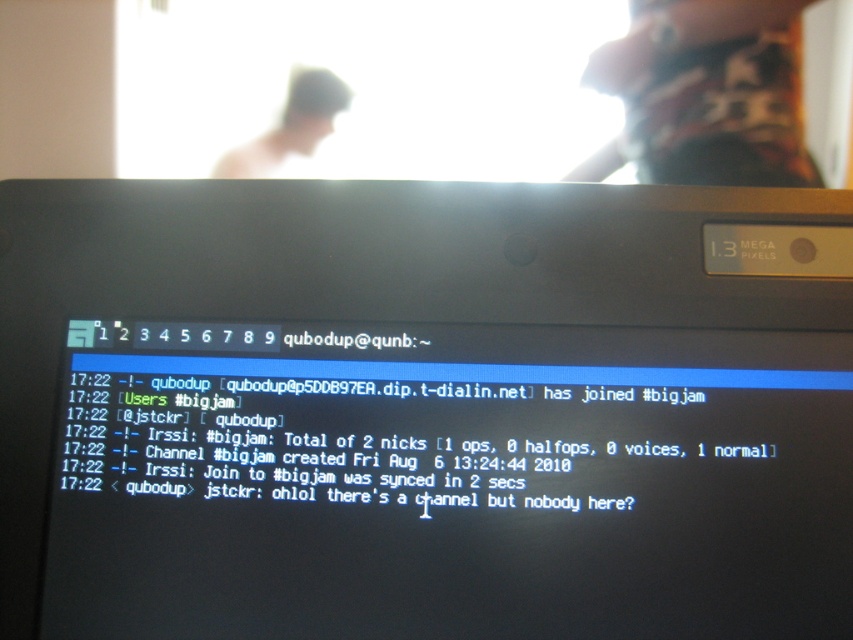
Between dark red fabric shirt at upper right and blurred skin head at upper center, which one appears on the left side from the viewer's perspective?

blurred skin head at upper center

Between dark red fabric shirt at upper right and blurred skin head at upper center, which one is positioned lower?

Positioned lower is blurred skin head at upper center.

Who is more forward, (645, 67) or (297, 74)?

Positioned in front is point (645, 67).

Find the location of a particular element. dark red fabric shirt at upper right is located at coordinates (704, 90).

The width and height of the screenshot is (853, 640). I want to click on black glossy laptop at center, so click(x=422, y=410).

Find the location of a particular element. This screenshot has height=640, width=853. black glossy laptop at center is located at coordinates (422, 410).

The height and width of the screenshot is (640, 853). What are the coordinates of `black glossy laptop at center` in the screenshot? It's located at point(422,410).

Is black glossy laptop at center in front of blurred skin head at upper center?

Yes, it is in front of blurred skin head at upper center.

Between point (506, 627) and point (331, 99), which one is positioned in front?

Point (506, 627) is more forward.

Who is more distant from viewer, (225, 184) or (225, 160)?

Point (225, 160)

Where is `black glossy laptop at center`? black glossy laptop at center is located at coordinates pos(422,410).